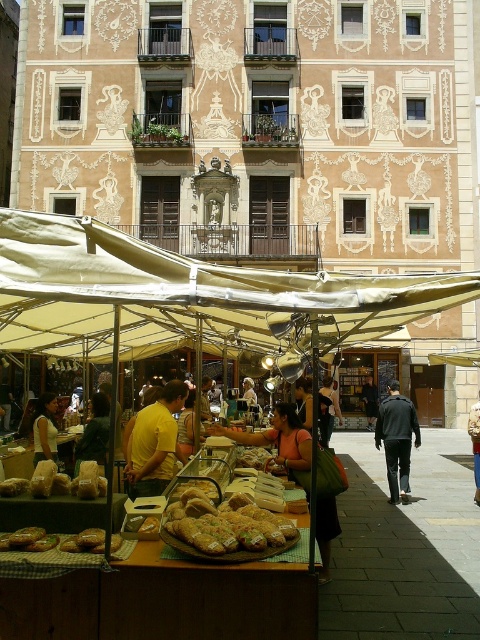
Does point (218, 317) come behind point (44, 413)?

No, it is not.

Can you confirm if beige fabric canopy at center is smaller than matte yellow shirt at center?

Actually, beige fabric canopy at center might be larger than matte yellow shirt at center.

What do you see at coordinates (184, 296) in the screenshot? The width and height of the screenshot is (480, 640). I see `beige fabric canopy at center` at bounding box center [184, 296].

Identify the location of beige fabric canopy at center. The image size is (480, 640). (184, 296).

Is matte brown bread at center positioned before golden brown crusty bread at center?

Yes, matte brown bread at center is in front of golden brown crusty bread at center.

Which is in front, point (130, 333) or point (250, 509)?

Point (250, 509)

The height and width of the screenshot is (640, 480). In order to click on matte brown bread at center in this screenshot , I will do `click(182, 296)`.

Image resolution: width=480 pixels, height=640 pixels. I want to click on matte brown bread at center, so click(x=182, y=296).

Is orange fabric bag at center bigger than dark gray sweater at center?

Correct, orange fabric bag at center is larger in size than dark gray sweater at center.

Does point (283, 452) lie in front of point (373, 404)?

Yes, it is in front of point (373, 404).

Find the location of `orange fabric bag at center`. orange fabric bag at center is located at coordinates (277, 438).